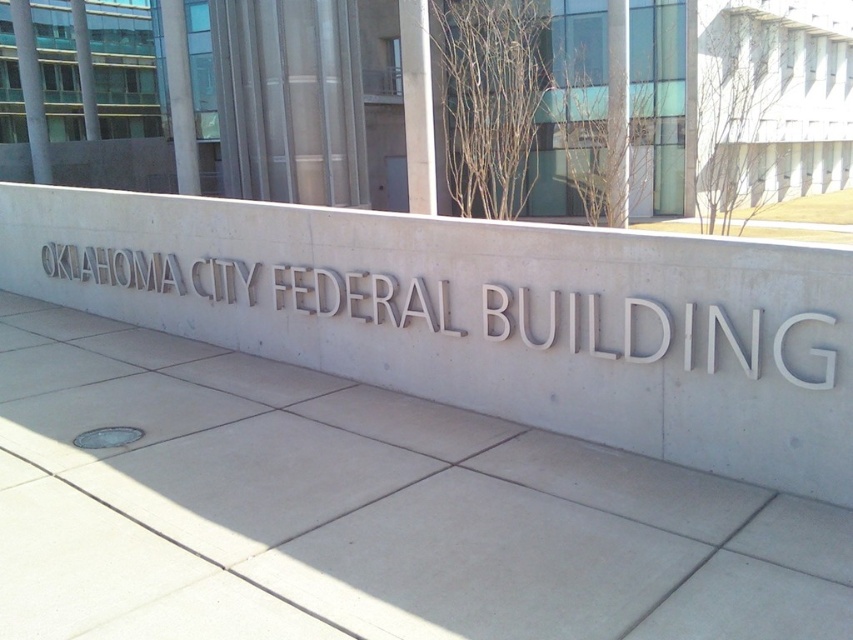
Who is positioned more to the left, gray concrete pavement at center or gray concrete sign at center?

Positioned to the left is gray concrete sign at center.

Who is positioned more to the right, gray concrete pavement at center or gray concrete sign at center?

From the viewer's perspective, gray concrete pavement at center appears more on the right side.

The height and width of the screenshot is (640, 853). What do you see at coordinates (363, 509) in the screenshot?
I see `gray concrete pavement at center` at bounding box center [363, 509].

Identify the location of gray concrete pavement at center. The height and width of the screenshot is (640, 853). (363, 509).

Is gray concrete pavement at center shorter than gray metallic sign at center?

Indeed, gray concrete pavement at center has a lesser height compared to gray metallic sign at center.

Is point (149, 557) positioned behind point (103, 268)?

No, (149, 557) is closer to viewer.

What are the coordinates of `gray concrete pavement at center` in the screenshot? It's located at (363, 509).

Which is behind, point (822, 266) or point (234, 291)?

Positioned behind is point (234, 291).

Is point (492, 400) less distant than point (376, 321)?

Yes, it is.

In order to click on gray concrete sign at center in this screenshot , I will do `click(485, 316)`.